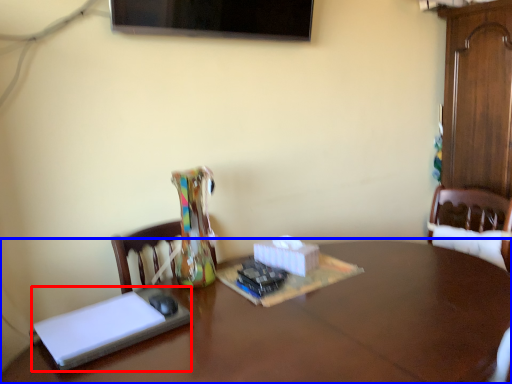
Question: Which point is further to the camera, book (highlighted by a red box) or table (highlighted by a blue box)?

Choices:
 (A) book
 (B) table

Answer: (A)